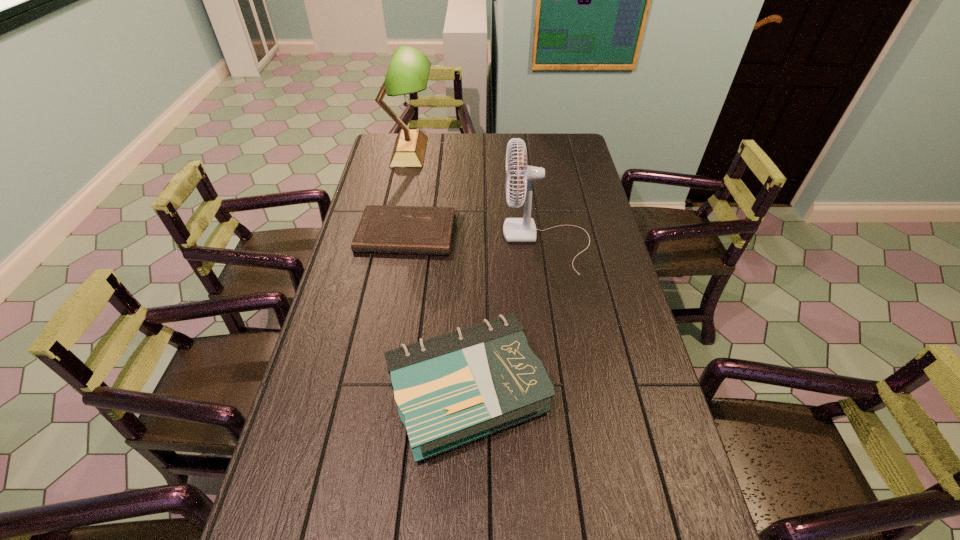
The image size is (960, 540). What are the coordinates of `the farthest object` in the screenshot? It's located at (408, 72).

In order to click on the third shortest object in this screenshot , I will do `click(523, 229)`.

Identify the location of the nearest object. (455, 388).

This screenshot has height=540, width=960. Find the location of `the nearer paperback book`. the nearer paperback book is located at coordinates (455, 388).

Where is `the shortest object`? This screenshot has width=960, height=540. the shortest object is located at coordinates (382, 229).

I want to click on the farther paperback book, so click(382, 229).

Where is `vacant area located 0.340m on the metallic stand of the table lamp`? The image size is (960, 540). vacant area located 0.340m on the metallic stand of the table lamp is located at coordinates (511, 152).

Where is `vacant space situated on the front-facing side of the fan`? vacant space situated on the front-facing side of the fan is located at coordinates (472, 242).

This screenshot has width=960, height=540. What are the coordinates of `vacant space located 0.270m on the front-facing side of the fan` in the screenshot? It's located at (426, 242).

Where is `free point located 0.380m on the front-facing side of the fan`? This screenshot has width=960, height=540. free point located 0.380m on the front-facing side of the fan is located at coordinates (395, 242).